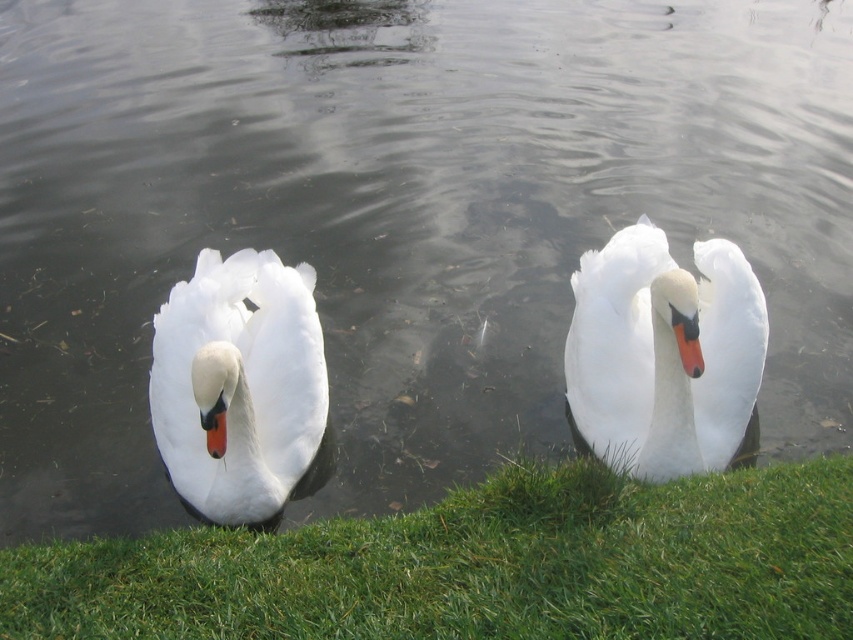
You are standing at the edge of the water and want to walk towards the white glossy swan at center. Which direction should you move relative to the green grass at lower center?

You should move to the right relative to the green grass at lower center because the white glossy swan at center is to the right of the green grass at lower center.

You are standing at the edge of the water in the scene and want to place a small marker at the point labeled point (x=479, y=564). Based on the description, what surface will the marker land on?

The point (x=479, y=564) corresponds to green grass at lower center, so the marker will land on the green grass at lower center.

You are standing at the edge of the water in the image and want to walk to the point closer to you. Which point should you head towards, point (785, 552) or point (315, 365)?

You should head towards point (785, 552) because it is closer to the viewer than point (315, 365).